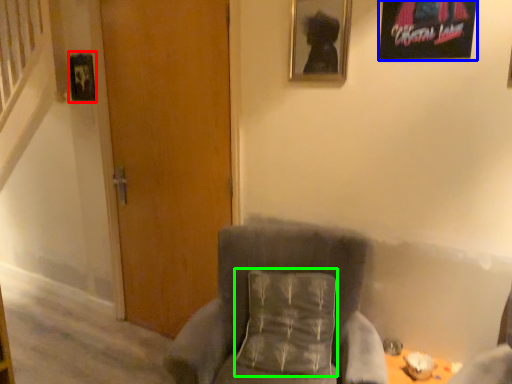
Question: Considering the real-world distances, which object is closest to picture frame (highlighted by a red box)? picture frame (highlighted by a blue box) or pillow (highlighted by a green box).

Choices:
 (A) picture frame
 (B) pillow

Answer: (B)